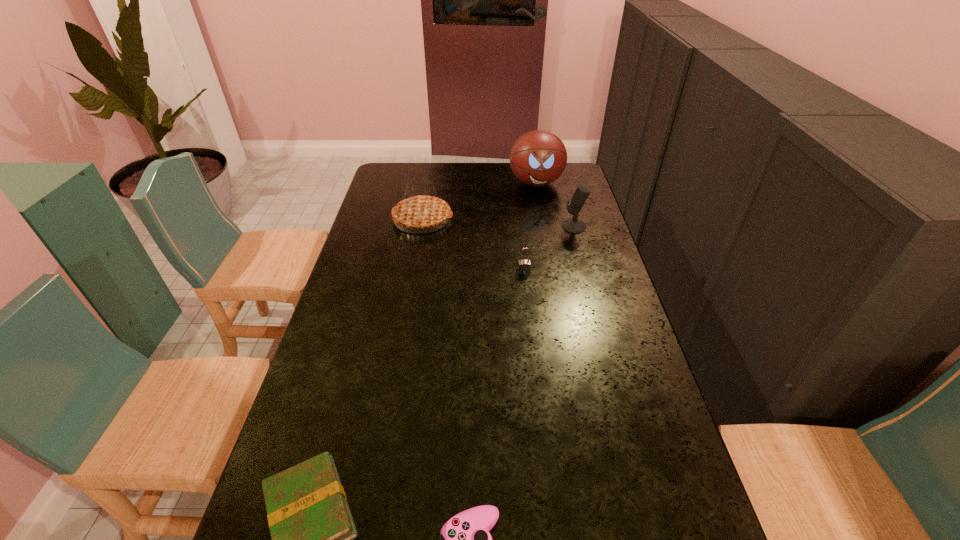
At what (x,y) coordinates should I click in order to perform the action: click on the tallest object. Please return your answer as a coordinate pair (x, y). Looking at the image, I should click on (538, 158).

This screenshot has width=960, height=540. I want to click on basketball, so click(x=538, y=158).

The height and width of the screenshot is (540, 960). I want to click on pie, so click(420, 211).

You are a GUI agent. You are given a task and a screenshot of the screen. Output one action in this format:
    pyautogui.click(x=<x>, y=<y>)
    Task: Click on the microphone
    
    Given the screenshot: What is the action you would take?
    pyautogui.click(x=574, y=225)

The width and height of the screenshot is (960, 540). Find the location of `padlock`. padlock is located at coordinates coord(524,266).

Where is `the fourth tallest object`? the fourth tallest object is located at coordinates (524, 266).

Identify the location of vacant space located on the front of the basketball. (542, 218).

Locate an element on the screen. vacant area situated 0.380m on the right of the pie is located at coordinates (556, 219).

In order to click on free region located on the back of the microphone in this screenshot , I will do `click(566, 200)`.

Find the location of `vacant space located 0.120m on the shackle of the fourth farthest object`. vacant space located 0.120m on the shackle of the fourth farthest object is located at coordinates (527, 300).